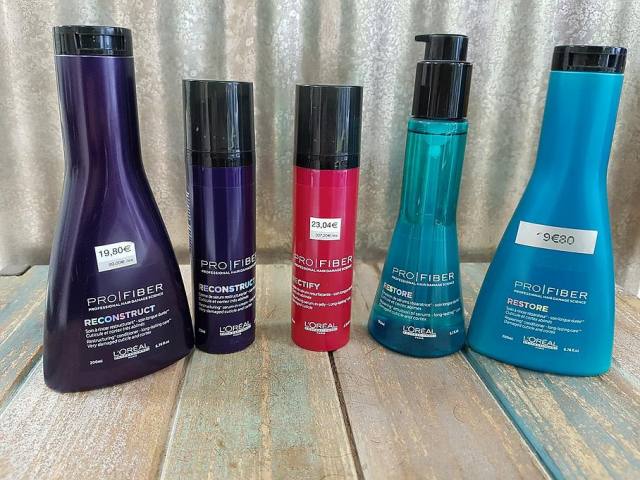
Locate an element on the screen. transparent blue container with black pump top is located at coordinates (443, 44), (429, 87), (413, 151), (397, 237), (454, 176), (451, 304).